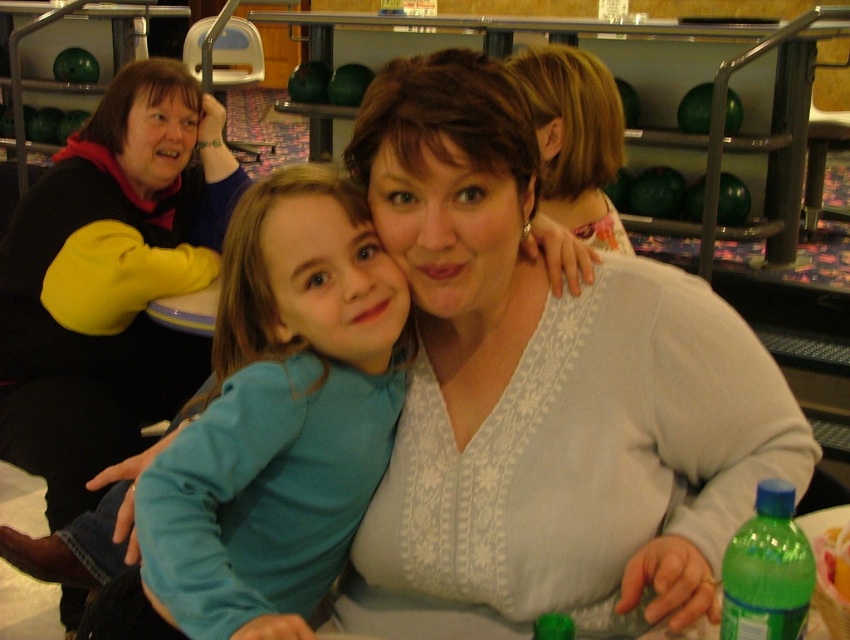
Which is above, white lace sweater at center or green plastic bottle at lower right?

white lace sweater at center

Does white lace sweater at center come in front of green plastic bottle at lower right?

No, white lace sweater at center is behind green plastic bottle at lower right.

Is point (616, 554) closer to viewer compared to point (726, 556)?

No.

Identify the location of white lace sweater at center. The image size is (850, 640). (544, 396).

Does teal fabric shirt at center appear under light brown hair at upper center?

Yes, teal fabric shirt at center is below light brown hair at upper center.

The width and height of the screenshot is (850, 640). What do you see at coordinates (280, 417) in the screenshot? I see `teal fabric shirt at center` at bounding box center [280, 417].

Is point (180, 602) positioned behind point (610, 212)?

No.

Find the location of a particular element. The image size is (850, 640). teal fabric shirt at center is located at coordinates (280, 417).

Consider the image. Who is positioned more to the left, white lace sweater at center or light brown hair at upper center?

Positioned to the left is white lace sweater at center.

Between point (624, 618) and point (615, 97), which one is positioned in front?

Point (624, 618) is in front.

Describe the element at coordinates (544, 396) in the screenshot. I see `white lace sweater at center` at that location.

Where is `white lace sweater at center`? This screenshot has width=850, height=640. white lace sweater at center is located at coordinates (544, 396).